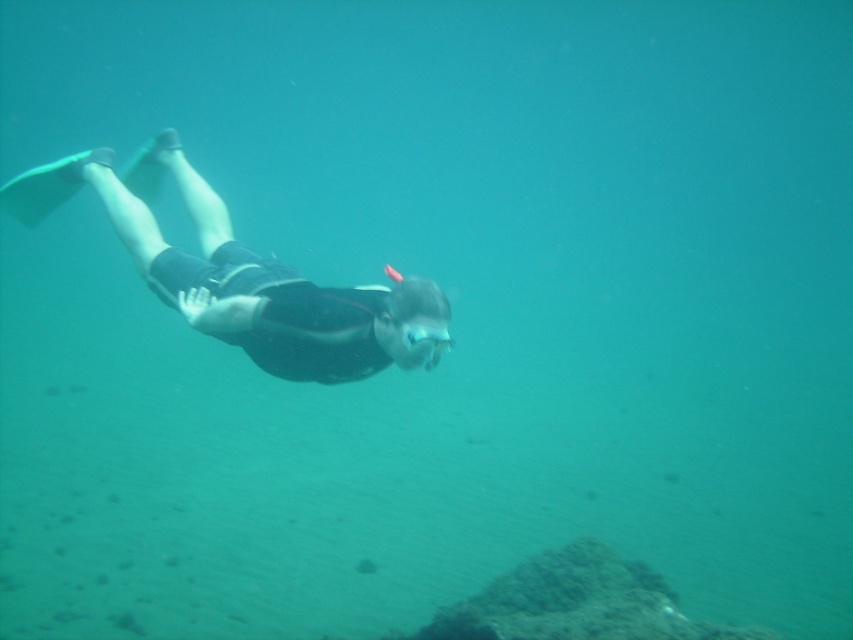
From the picture: You are a marine biologist observing an underwater scene. You notice the black matte wetsuit at center and want to capture a closeup photo with your camera. Given that the camera is 10.36 feet away from the wetsuit, is this distance within the recommended 10 feet range for optimal underwater photography?

The black matte wetsuit at center and camera are 10.36 feet apart, which exceeds the recommended 10 feet range for optimal underwater photography. To achieve the best results, you should move closer to ensure the distance is within 10 feet.

You are a marine biologist observing the underwater scene. You notice the black matte wetsuit at center and the clear plastic goggles at center. Which object is positioned to the left in this scene?

The black matte wetsuit at center is to the left of the clear plastic goggles at center.

You are a marine biologist observing the underwater scene. You notice the black matte wetsuit at center and the clear plastic goggles at center. Which object appears larger in size?

The black matte wetsuit at center is much taller than the clear plastic goggles at center, so it appears larger in size.